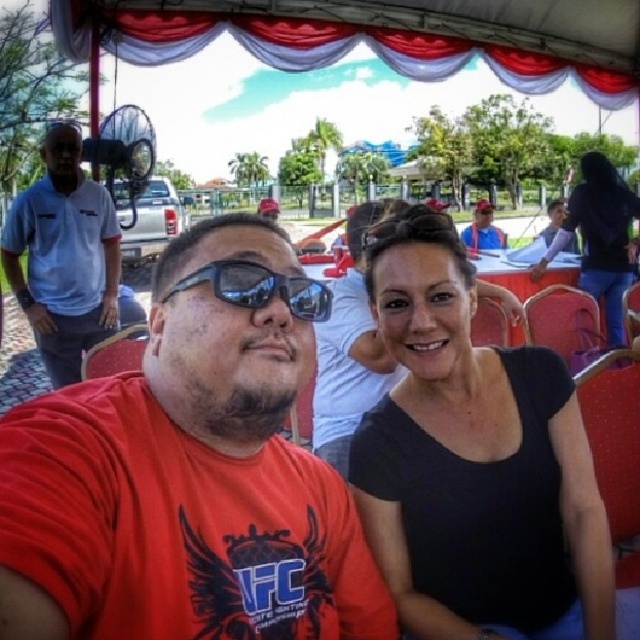
Which of these two, light blue cotton polo shirt at left or black plastic sunglasses at center, stands shorter?

Standing shorter between the two is black plastic sunglasses at center.

You are a GUI agent. You are given a task and a screenshot of the screen. Output one action in this format:
    pyautogui.click(x=<x>, y=<y>)
    Task: Click on the light blue cotton polo shirt at left
    This screenshot has width=640, height=640.
    Given the screenshot: What is the action you would take?
    pyautogui.click(x=64, y=257)

Where is `light blue cotton polo shirt at left`? light blue cotton polo shirt at left is located at coordinates (64, 257).

Is matte red t-shirt at center below black plastic sunglasses at center?

Indeed, matte red t-shirt at center is positioned under black plastic sunglasses at center.

Which of these two, matte red t-shirt at center or black plastic sunglasses at center, stands shorter?

black plastic sunglasses at center is shorter.

Which is behind, point (332, 621) or point (237, 304)?

Positioned behind is point (332, 621).

Find the location of a particular element. The height and width of the screenshot is (640, 640). matte red t-shirt at center is located at coordinates (186, 477).

Who is lower down, black fabric shirt at upper right or matte blue shirt at upper right?

black fabric shirt at upper right

Which of these two, black fabric shirt at upper right or matte blue shirt at upper right, stands taller?

matte blue shirt at upper right is taller.

Where is `black fabric shirt at upper right`? This screenshot has height=640, width=640. black fabric shirt at upper right is located at coordinates (600, 236).